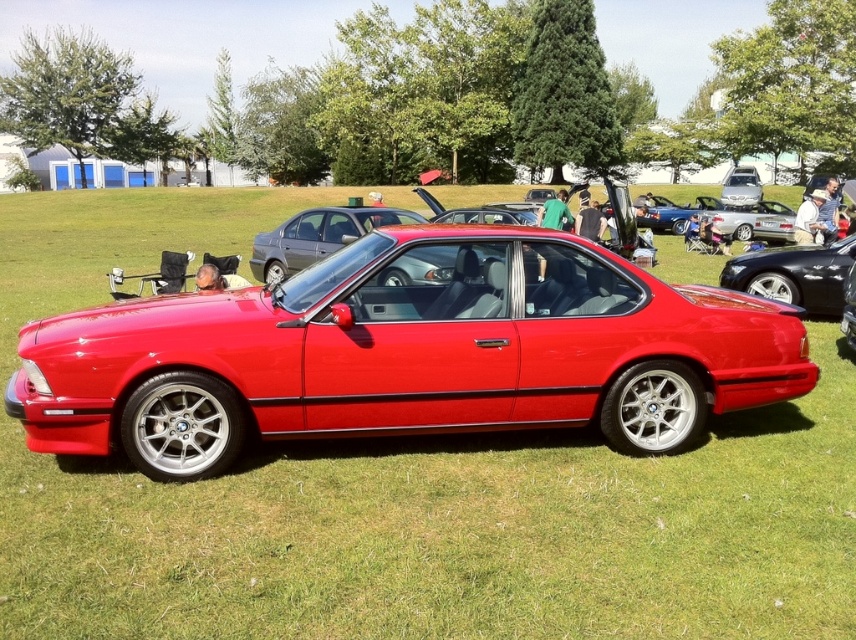
Question: Which of the following is the closest to the observer?

Choices:
 (A) glossy metallic sedan at center
 (B) glossy red car at center

Answer: (B)

Question: Estimate the real-world distances between objects in this image. Which object is closer to the glossy metallic sedan at center?

Choices:
 (A) glossy metallic car at center
 (B) glossy red car at center

Answer: (A)

Question: Can you confirm if glossy metallic car at center is positioned to the right of glossy metallic sedan at center?

Choices:
 (A) no
 (B) yes

Answer: (B)

Question: Considering the relative positions of glossy red car at center and glossy metallic sedan at center in the image provided, where is glossy red car at center located with respect to glossy metallic sedan at center?

Choices:
 (A) right
 (B) left

Answer: (A)

Question: Considering the real-world distances, which object is farthest from the glossy metallic car at center?

Choices:
 (A) glossy metallic sedan at center
 (B) glossy red car at center

Answer: (B)

Question: Is glossy red car at center positioned at the back of glossy metallic car at center?

Choices:
 (A) no
 (B) yes

Answer: (A)